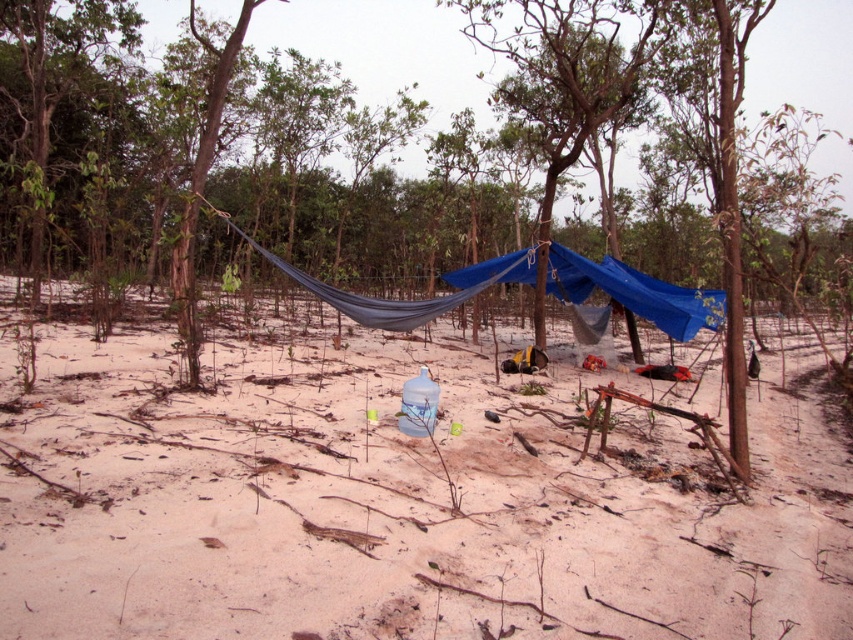
You are planning to set up a small tent at the campsite. The tent requires a flat area of 5 meters in length. Given the distance between the white sandy ground at center and the blue fabric canopy at center, can you determine if there is enough space to set up the tent between them?

The distance between the white sandy ground at center and the blue fabric canopy at center is 5.29 meters. Since the tent requires 5 meters, there is sufficient space to set up the tent between them.

You are setting up a campsite and want to place a small tent on the white sandy ground at center. Is the blue fabric canopy at center above the spot where you want to place the tent?

Yes, the blue fabric canopy at center is above the white sandy ground at center, so placing the tent there would mean the canopy is overhead.

You are setting up a tent at the campsite and need to know if the white sandy ground at center is higher than the blue fabric canopy at center. Can you determine this based on the scene?

The white sandy ground at center is not as tall as blue fabric canopy at center, so the ground is lower than the canopy.